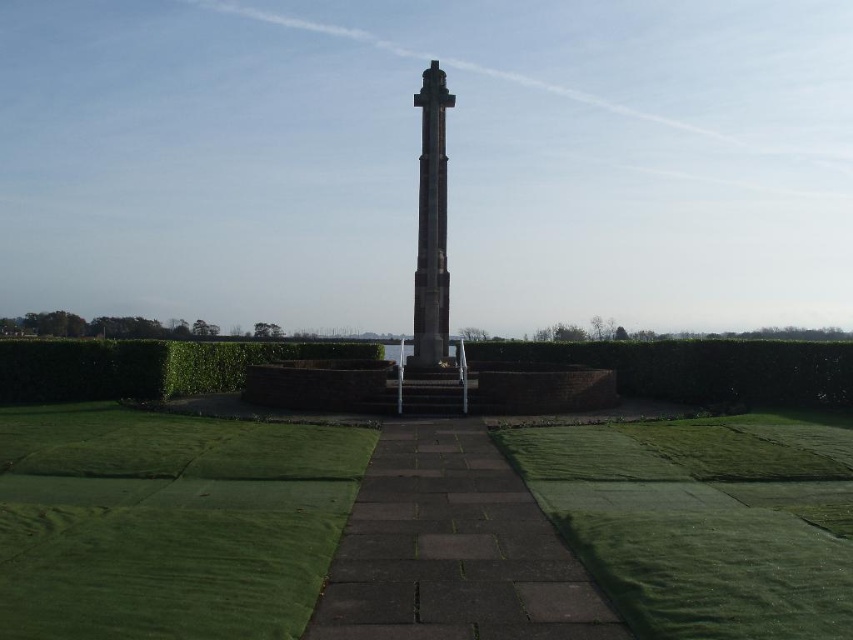
Question: Which point appears closest to the camera in this image?

Choices:
 (A) (6, 442)
 (B) (166, 385)
 (C) (566, 490)
 (D) (421, 148)

Answer: (C)

Question: Is green grass at lower left smaller than green turf at lower right?

Choices:
 (A) yes
 (B) no

Answer: (B)

Question: Estimate the real-world distances between objects in this image. Which object is farther from the green turf at lower right?

Choices:
 (A) green hedge at lower left
 (B) dark gray stone tower at center
 (C) green hedge at center

Answer: (A)

Question: Does green grass at lower left appear on the left side of green hedge at lower left?

Choices:
 (A) yes
 (B) no

Answer: (B)

Question: Does green hedge at center appear on the right side of green hedge at lower left?

Choices:
 (A) yes
 (B) no

Answer: (A)

Question: Which object is closer to the camera taking this photo?

Choices:
 (A) green turf at lower right
 (B) dark gray stone tower at center

Answer: (A)